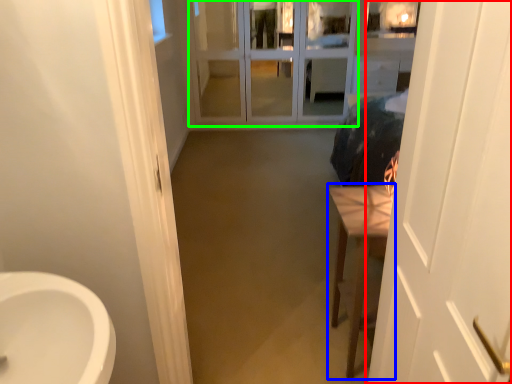
Question: Based on their relative distances, which object is farther from door (highlighted by a red box)? Choose from furniture (highlighted by a blue box) and screen door (highlighted by a green box).

Choices:
 (A) furniture
 (B) screen door

Answer: (B)